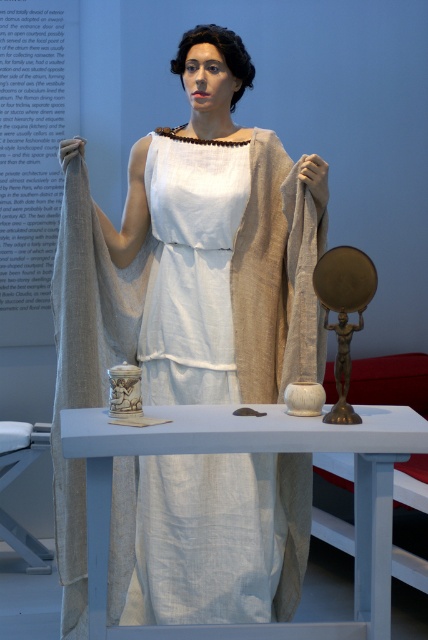
Question: Is matte white dress at center smaller than white linen table at center?

Choices:
 (A) yes
 (B) no

Answer: (B)

Question: Is matte white dress at center in front of white linen table at center?

Choices:
 (A) yes
 (B) no

Answer: (B)

Question: Which object appears farthest from the camera in this image?

Choices:
 (A) white linen table at center
 (B) matte white dress at center

Answer: (B)

Question: From the image, what is the correct spatial relationship of matte white dress at center in relation to white linen table at center?

Choices:
 (A) below
 (B) above

Answer: (B)